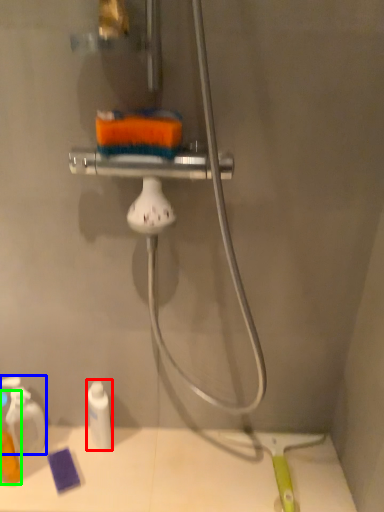
Question: Based on their relative distances, which object is farther from toiletry (highlighted by a red box)? Choose from toiletry (highlighted by a blue box) and toiletry (highlighted by a green box).

Choices:
 (A) toiletry
 (B) toiletry

Answer: (B)